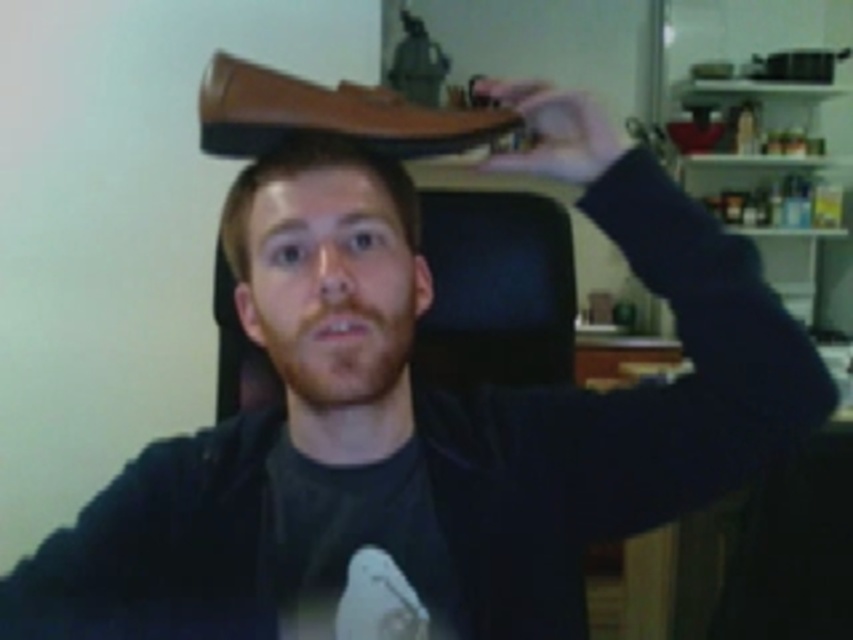
You are a delivery person who needs to determine if the brown leather shoe at upper center and the matte brown shoe at upper center can fit side by side on a shelf that is 10 inches wide. What should you consider?

The brown leather shoe at upper center is wider than the matte brown shoe at upper center. To determine if they can fit together, measure their combined width and compare it to the 10 inches shelf space available.

You are a photographer setting up a shoot in this room. You need to place a small tripod between the brown leather hat at center and the matte brown shoe at upper center. Based on their sizes, which object should the tripod be closer to?

The brown leather hat at center has a lesser width compared to matte brown shoe at upper center, so the tripod should be placed closer to the brown leather hat at center to ensure stability between the two objects.